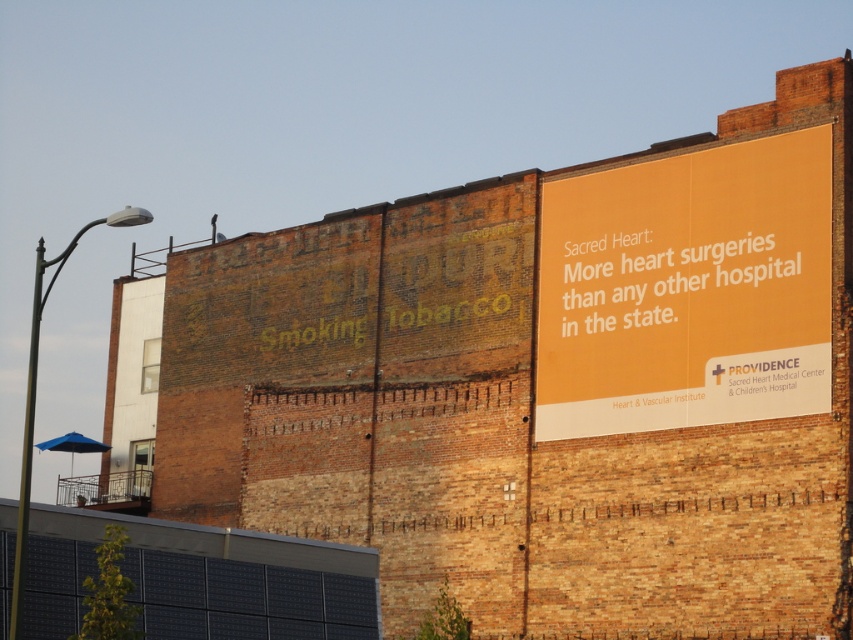
You are a pedestrian standing in front of the brick building and see the matte orange sign at upper right and the orange matte sign at upper right. Which one is positioned lower?

The matte orange sign at upper right is positioned lower than the orange matte sign at upper right.

You are a painter standing on a ladder in front of the brick building. You need to paint the matte orange sign at upper right and the orange matte sign at upper right. Which one requires a longer ladder to reach the top?

The matte orange sign at upper right is much taller than the orange matte sign at upper right, so you need a longer ladder to reach the top of the matte orange sign at upper right.